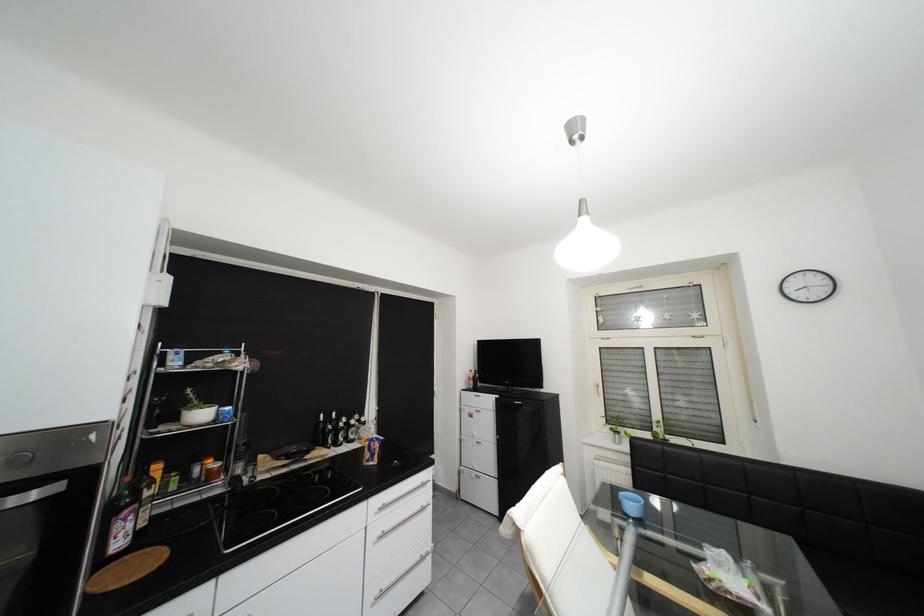
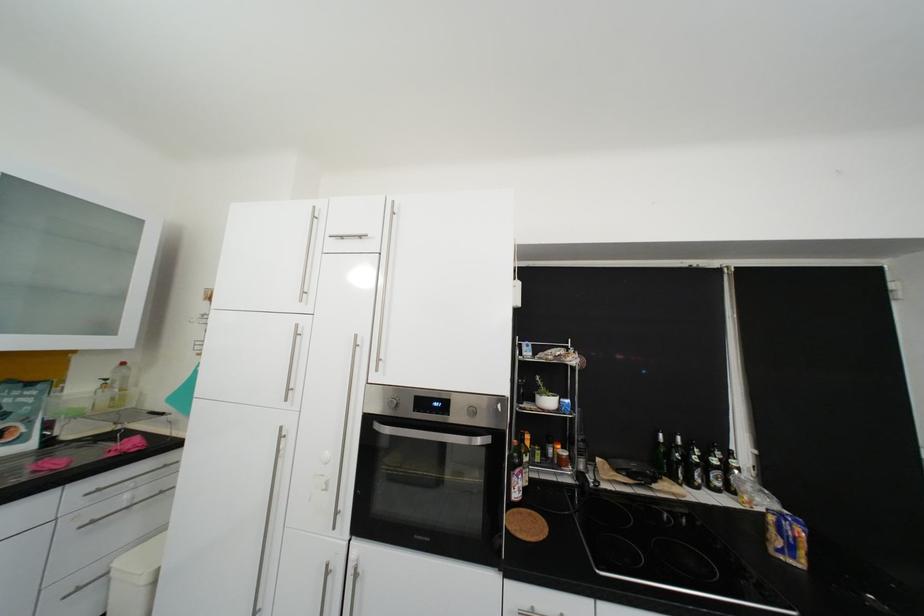
Locate, in the second image, the point that corresponds to pixel 385 294 in the first image.

(731, 272)